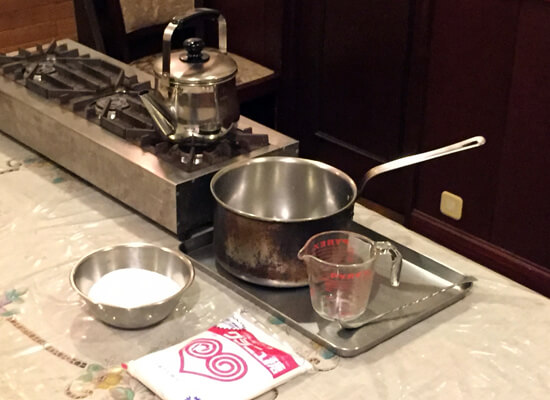
Where is `pot`? pot is located at coordinates (285, 228).